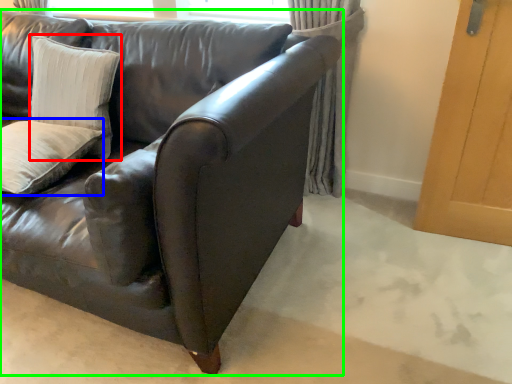
Question: Which object is the farthest from pillow (highlighted by a red box)? Choose among these: pillow (highlighted by a blue box) or studio couch (highlighted by a green box).

Choices:
 (A) pillow
 (B) studio couch

Answer: (B)